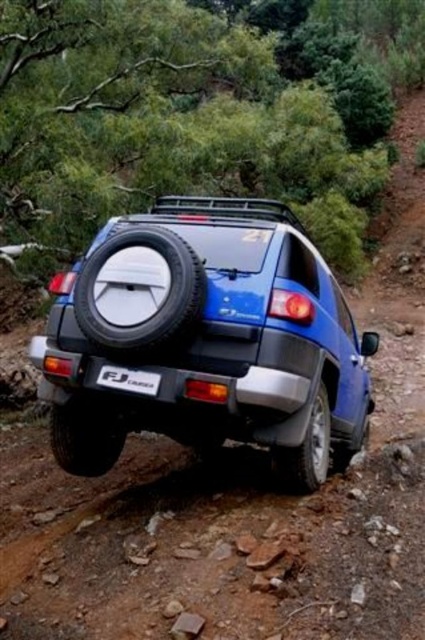
Question: From the image, what is the correct spatial relationship of blue matte suv at center in relation to black rubber tire at lower right?

Choices:
 (A) above
 (B) below

Answer: (A)

Question: Among these points, which one is nearest to the camera?

Choices:
 (A) (82, 465)
 (B) (87, 348)
 (C) (133, 282)
 (D) (317, 474)

Answer: (C)

Question: Can you confirm if rubber/textured tire at center is bigger than black plastic license plate at center?

Choices:
 (A) no
 (B) yes

Answer: (B)

Question: Which is nearer to the black rubber tire at lower right?

Choices:
 (A) black plastic license plate at center
 (B) rubber/textured tire at center
 (C) black rubber tire at lower left

Answer: (A)

Question: Is black rubber tire at lower left below black rubber tire at lower right?

Choices:
 (A) yes
 (B) no

Answer: (A)

Question: Which of the following is the farthest from the observer?

Choices:
 (A) black plastic license plate at center
 (B) black rubber tire at lower left

Answer: (B)